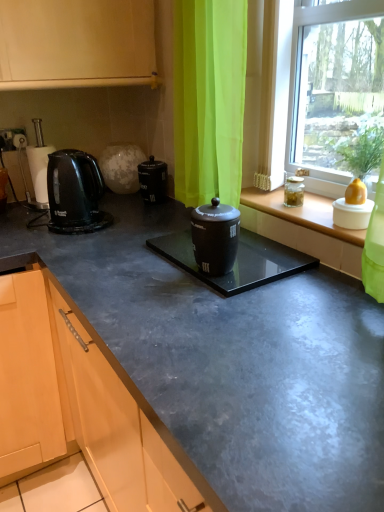
Identify the location of vacant region in front of black plastic kettle at left. (32, 212).